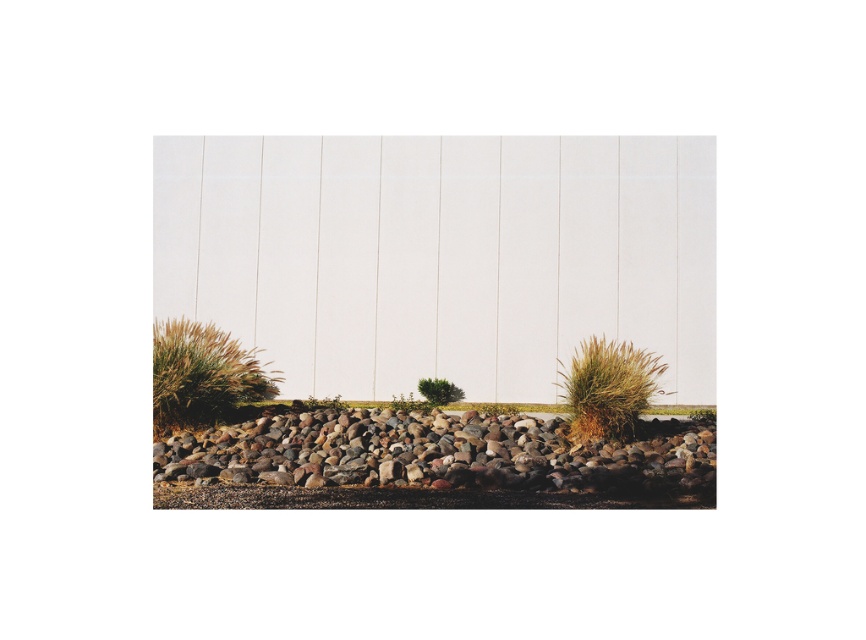
Does brown grass at lower left have a larger size compared to brown fuzzy bush at lower right?

Indeed, brown grass at lower left has a larger size compared to brown fuzzy bush at lower right.

Is point (256, 349) farther from camera compared to point (628, 358)?

Yes, point (256, 349) is behind point (628, 358).

Where is `brown grass at lower left`? The image size is (866, 640). brown grass at lower left is located at coordinates (204, 372).

Can you confirm if smooth brown stones at center is wider than brown fuzzy bush at lower right?

No.

Who is more forward, (456,417) or (606,385)?

Point (606,385)

This screenshot has width=866, height=640. Find the location of `smooth brown stones at center`. smooth brown stones at center is located at coordinates (433, 464).

Which of these two, brown fuzzy bush at lower right or green leafy bush at center, stands taller?

With more height is brown fuzzy bush at lower right.

Which is in front, point (603, 362) or point (436, 401)?

Point (603, 362) is in front.

The image size is (866, 640). Find the location of `brown fuzzy bush at lower right`. brown fuzzy bush at lower right is located at coordinates (608, 387).